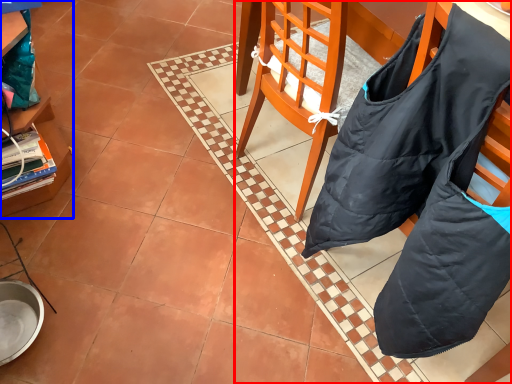
Question: Which point is further to the camera, chair (highlighted by a red box) or cabinetry (highlighted by a blue box)?

Choices:
 (A) chair
 (B) cabinetry

Answer: (B)